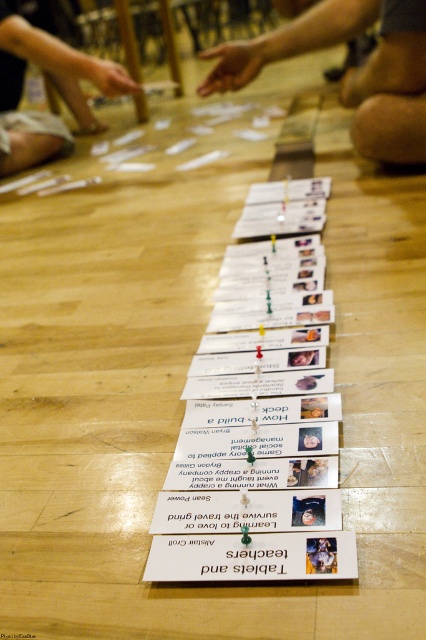
Question: Which point is closer to the camera?

Choices:
 (A) matte black hand at upper left
 (B) skinny jeans at center

Answer: (B)

Question: Is skinny jeans at center behind matte black hand at upper left?

Choices:
 (A) no
 (B) yes

Answer: (A)

Question: Estimate the real-world distances between objects in this image. Which object is farther from the matte black hand at upper left?

Choices:
 (A) white paper cards at center
 (B) skinny jeans at center

Answer: (A)

Question: Estimate the real-world distances between objects in this image. Which object is closer to the white paper cards at center?

Choices:
 (A) matte black hand at upper left
 (B) skinny jeans at center

Answer: (B)

Question: From the image, what is the correct spatial relationship of skinny jeans at center in relation to matte black hand at upper left?

Choices:
 (A) above
 (B) below

Answer: (A)

Question: Is skinny jeans at center to the left of matte black hand at upper left from the viewer's perspective?

Choices:
 (A) no
 (B) yes

Answer: (A)